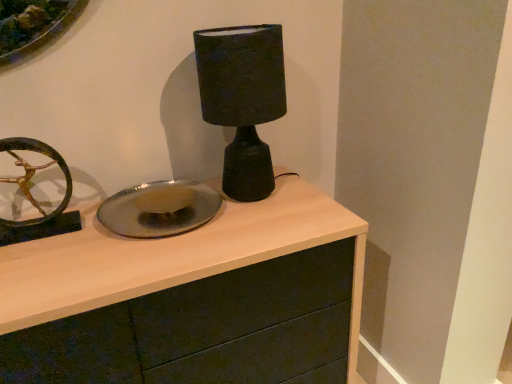
Describe the element at coordinates (242, 100) in the screenshot. I see `matte black lamp at center` at that location.

The image size is (512, 384). What are the coordinates of `matte wood chest of drawers at center` in the screenshot? It's located at (174, 258).

From the image's perspective, does matte wood chest of drawers at center appear lower than shiny metallic plate at center?

Indeed, from the image's perspective, matte wood chest of drawers at center is shown beneath shiny metallic plate at center.

Which object is wider, matte wood chest of drawers at center or shiny metallic plate at center?

With larger width is matte wood chest of drawers at center.

Is matte wood chest of drawers at center outside of shiny metallic plate at center?

Yes, matte wood chest of drawers at center is outside of shiny metallic plate at center.

Looking at this image, visually, is matte wood chest of drawers at center positioned to the left or to the right of shiny metallic plate at center?

In the image, matte wood chest of drawers at center appears on the right side of shiny metallic plate at center.

What's the angular difference between shiny metallic plate at center and matte wood chest of drawers at center's facing directions?

The facing directions of shiny metallic plate at center and matte wood chest of drawers at center are 1.13 degrees apart.

Is point (166, 181) closer or farther from the camera than point (51, 248)?

Point (166, 181) is positioned farther from the camera compared to point (51, 248).

Looking at this image, in terms of width, does shiny metallic plate at center look wider or thinner when compared to matte wood chest of drawers at center?

shiny metallic plate at center is thinner than matte wood chest of drawers at center.

Which of these two, matte black lamp at center or matte wood chest of drawers at center, is wider?

matte wood chest of drawers at center is wider.

Which object is positioned more to the left, matte black lamp at center or matte wood chest of drawers at center?

matte wood chest of drawers at center is more to the left.

Which of these two, matte black lamp at center or matte wood chest of drawers at center, stands shorter?

Standing shorter between the two is matte black lamp at center.

Identify the location of plate behind the matte black lamp at center. (159, 209).

In terms of size, does shiny metallic plate at center appear bigger or smaller than matte black lamp at center?

Considering their sizes, shiny metallic plate at center takes up less space than matte black lamp at center.

From the image's perspective, is shiny metallic plate at center located above matte black lamp at center?

No.

From a real-world perspective, is shiny metallic plate at center beneath matte black lamp at center?

Indeed, from a real-world perspective, shiny metallic plate at center is positioned beneath matte black lamp at center.

In the scene shown: From the image's perspective, is matte black lamp at center located above or below shiny metallic plate at center?

From the image's perspective, matte black lamp at center appears above shiny metallic plate at center.

Does matte black lamp at center turn towards shiny metallic plate at center?

No, matte black lamp at center is not oriented towards shiny metallic plate at center.

Is matte black lamp at center situated inside shiny metallic plate at center or outside?

matte black lamp at center is outside shiny metallic plate at center.

Is matte black lamp at center further to the viewer compared to shiny metallic plate at center?

No, matte black lamp at center is in front of shiny metallic plate at center.

Image resolution: width=512 pixels, height=384 pixels. I want to click on table lamp above the matte wood chest of drawers at center (from a real-world perspective), so click(242, 100).

How different are the orientations of matte wood chest of drawers at center and matte black lamp at center in degrees?

The angular difference between matte wood chest of drawers at center and matte black lamp at center is 0.195 degrees.

Does matte wood chest of drawers at center lie in front of matte black lamp at center?

Yes, matte wood chest of drawers at center is closer to the viewer.

I want to click on plate lying on the left of matte wood chest of drawers at center, so click(x=159, y=209).

Image resolution: width=512 pixels, height=384 pixels. I want to click on plate behind the matte wood chest of drawers at center, so click(x=159, y=209).

Estimate the real-world distances between objects in this image. Which object is closer to shiny metallic plate at center, matte wood chest of drawers at center or matte black lamp at center?

The object closer to shiny metallic plate at center is matte wood chest of drawers at center.

Which object lies nearer to the anchor point matte black lamp at center, shiny metallic plate at center or matte wood chest of drawers at center?

shiny metallic plate at center lies closer to matte black lamp at center than the other object.

Considering their positions, is shiny metallic plate at center positioned further to matte wood chest of drawers at center than matte black lamp at center?

matte black lamp at center is further to matte wood chest of drawers at center.

Considering their positions, is matte black lamp at center positioned closer to matte wood chest of drawers at center than shiny metallic plate at center?

shiny metallic plate at center is positioned closer to the anchor matte wood chest of drawers at center.

When comparing their distances from matte black lamp at center, does matte wood chest of drawers at center or shiny metallic plate at center seem further?

The object further to matte black lamp at center is matte wood chest of drawers at center.

Which object lies further to the anchor point shiny metallic plate at center, matte black lamp at center or matte wood chest of drawers at center?

matte black lamp at center is further to shiny metallic plate at center.

Identify the location of plate between matte black lamp at center and matte wood chest of drawers at center in the up-down direction. This screenshot has height=384, width=512. (159, 209).